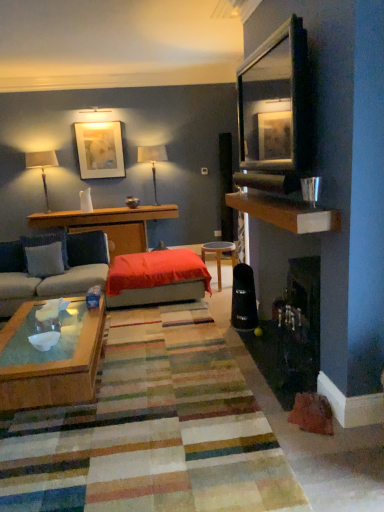
This screenshot has height=512, width=384. I want to click on vacant area on top of white glossy bowl at center (from a real-world perspective), so click(44, 338).